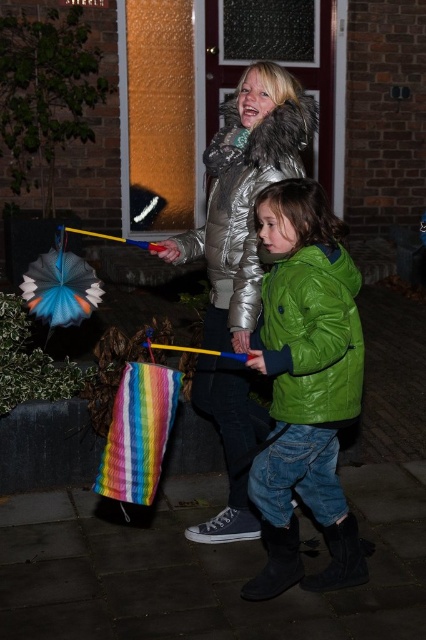
Who is more distant from viewer, (261, 97) or (270, 129)?

Positioned behind is point (261, 97).

Who is lower down, silver metallic jacket at upper center or silver metallic jacket at center?

silver metallic jacket at upper center is lower down.

Is point (275, 113) positioned behind point (305, 106)?

No, it is not.

Where is `silver metallic jacket at upper center`? silver metallic jacket at upper center is located at coordinates (244, 196).

Which of these two, green matte jacket at center or green shiny jacket at lower center, stands taller?

green matte jacket at center is taller.

Does green matte jacket at center have a lesser height compared to green shiny jacket at lower center?

No, green matte jacket at center is not shorter than green shiny jacket at lower center.

This screenshot has width=426, height=640. Find the location of `green matte jacket at center`. green matte jacket at center is located at coordinates (305, 387).

The image size is (426, 640). Identify the location of green matte jacket at center. (305, 387).

Is point (290, 77) in front of point (313, 330)?

No, (290, 77) is further to viewer.

Does silver metallic jacket at upper center appear over green shiny jacket at lower center?

Yes, silver metallic jacket at upper center is above green shiny jacket at lower center.

Is point (219, 524) behind point (294, 340)?

That is True.

You are a GUI agent. You are given a task and a screenshot of the screen. Output one action in this format:
    pyautogui.click(x=<x>, y=<y>)
    Task: Click on the silver metallic jacket at upper center
    The width and height of the screenshot is (426, 640).
    Given the screenshot: What is the action you would take?
    pyautogui.click(x=244, y=196)